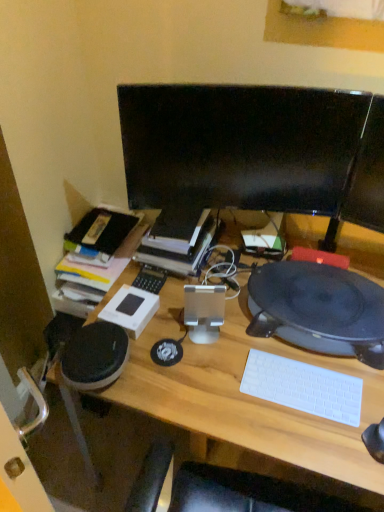
Find the location of a particular element. The height and width of the screenshot is (512, 384). blank area beneath white plastic keyboard at lower right (from a real-world perspective) is located at coordinates (303, 389).